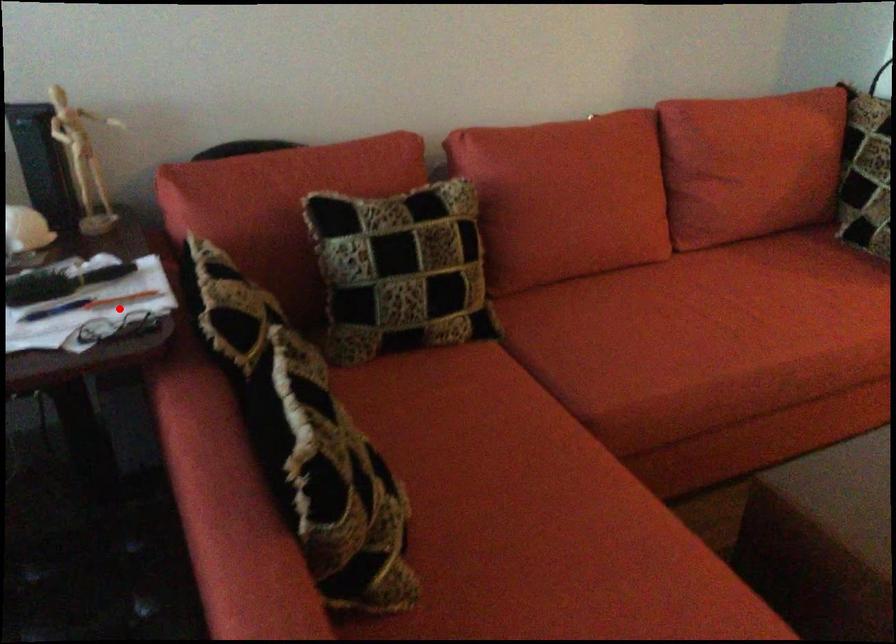
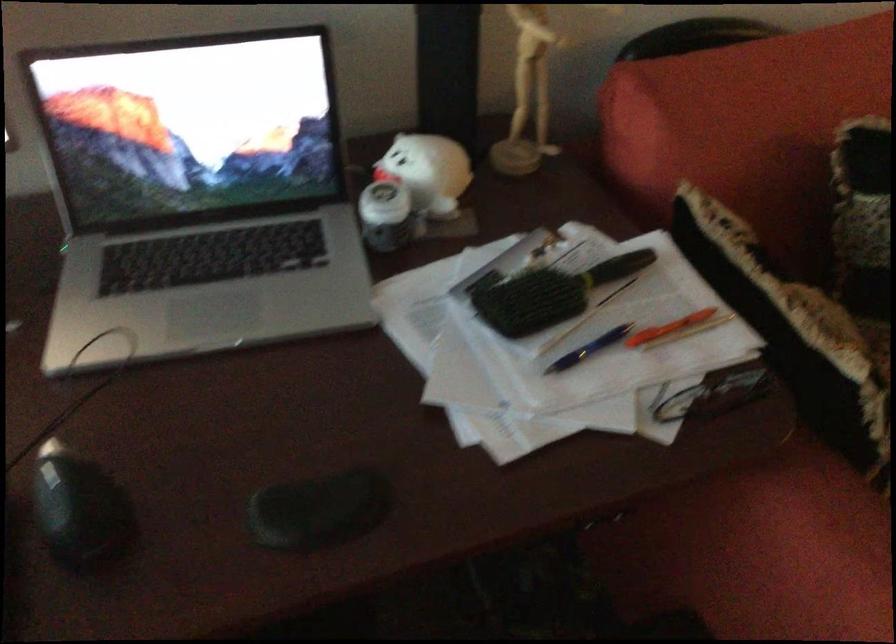
Question: A red point is marked in image1. In image2, is the corresponding 3D point closer to the camera or farther? Reply with the corresponding letter.

Choices:
 (A) The corresponding 3D point is closer.
 (B) The corresponding 3D point is farther.

Answer: (A)